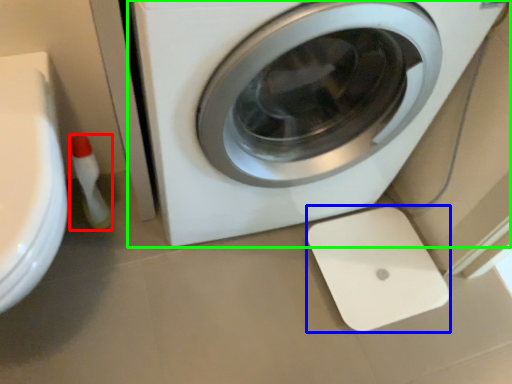
Question: Estimate the real-world distances between objects in this image. Which object is closer to cleaning product (highlighted by a red box), appliance (highlighted by a blue box) or washing machine (highlighted by a green box)?

Choices:
 (A) appliance
 (B) washing machine

Answer: (B)